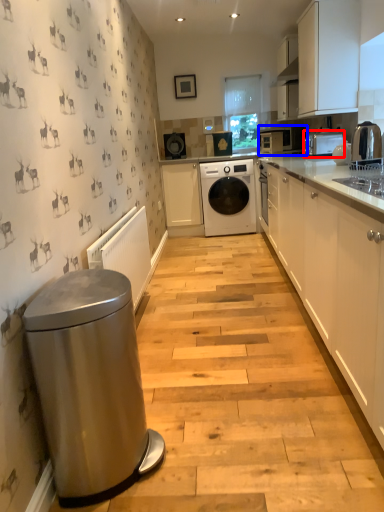
Question: Among these objects, which one is nearest to the camera, home appliance (highlighted by a red box) or home appliance (highlighted by a blue box)?

Choices:
 (A) home appliance
 (B) home appliance

Answer: (A)